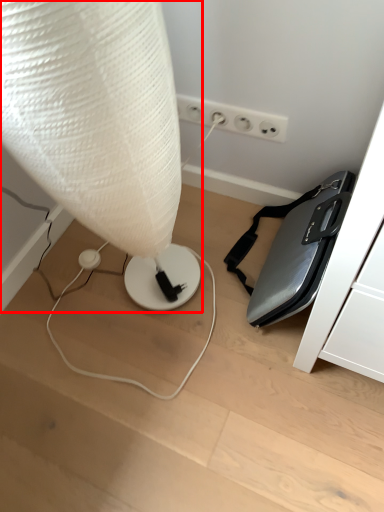
Question: From the image's perspective, considering the relative positions of lamp (annotated by the red box) and electric outlet in the image provided, where is lamp (annotated by the red box) located with respect to the staircase?

Choices:
 (A) below
 (B) above

Answer: (A)